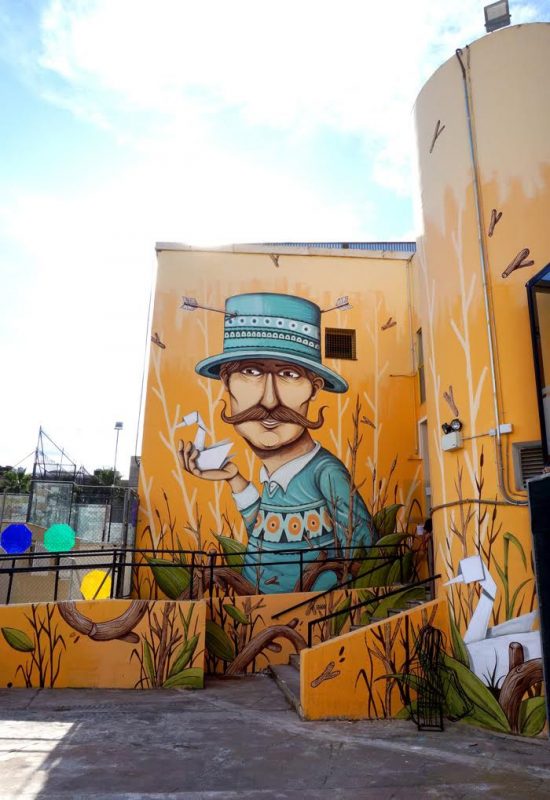
The width and height of the screenshot is (550, 800). What are the coordinates of `wall` in the screenshot? It's located at (330, 701).